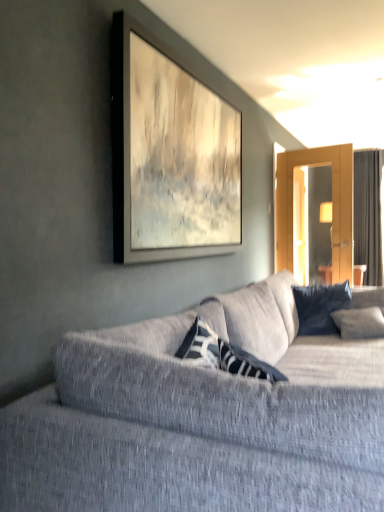
Question: Would you say dark blue textured pillow at center is inside or outside textured gray couch at center?

Choices:
 (A) inside
 (B) outside

Answer: (A)

Question: Based on their sizes in the image, would you say dark blue textured pillow at center is bigger or smaller than textured gray couch at center?

Choices:
 (A) small
 (B) big

Answer: (A)

Question: Considering the real-world distances, which object is farthest from the textured gray couch at center?

Choices:
 (A) dark gray fabric curtain at right
 (B) dark blue textured pillow at center

Answer: (A)

Question: Estimate the real-world distances between objects in this image. Which object is farther from the textured gray couch at center?

Choices:
 (A) dark blue textured pillow at center
 (B) dark gray fabric curtain at right

Answer: (B)